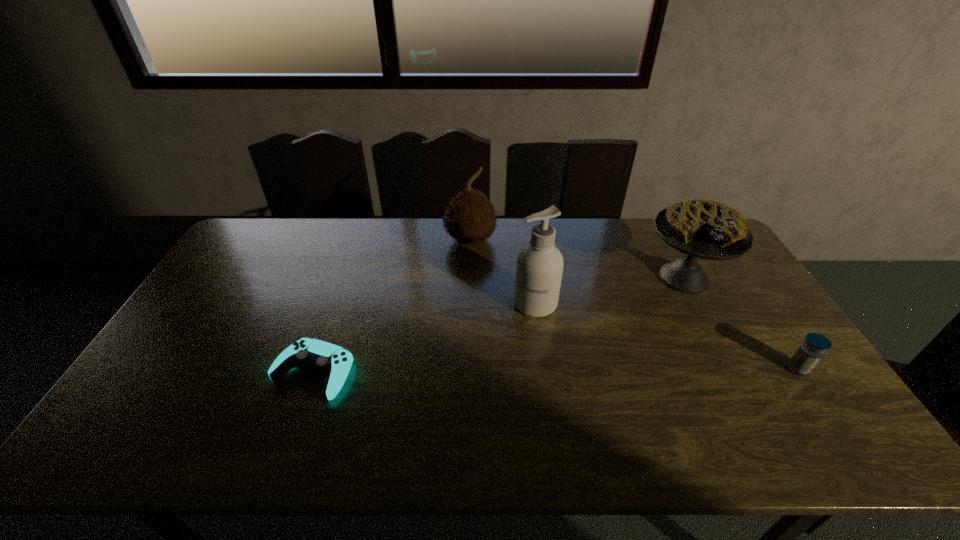
Image resolution: width=960 pixels, height=540 pixels. I want to click on free spot on the desktop that is between the leftmost object and the medicine and is positioned on the cut side of the fourth object from left to right, so click(609, 370).

Identify the location of free space on the desktop that is between the leftmost object and the medicine and is positioned on the front label of the third object from right to left. The width and height of the screenshot is (960, 540). (515, 370).

Image resolution: width=960 pixels, height=540 pixels. Identify the location of vacant space on the desktop that is between the shortest object and the medicine and is positioned on the surface of the coconut. (612, 370).